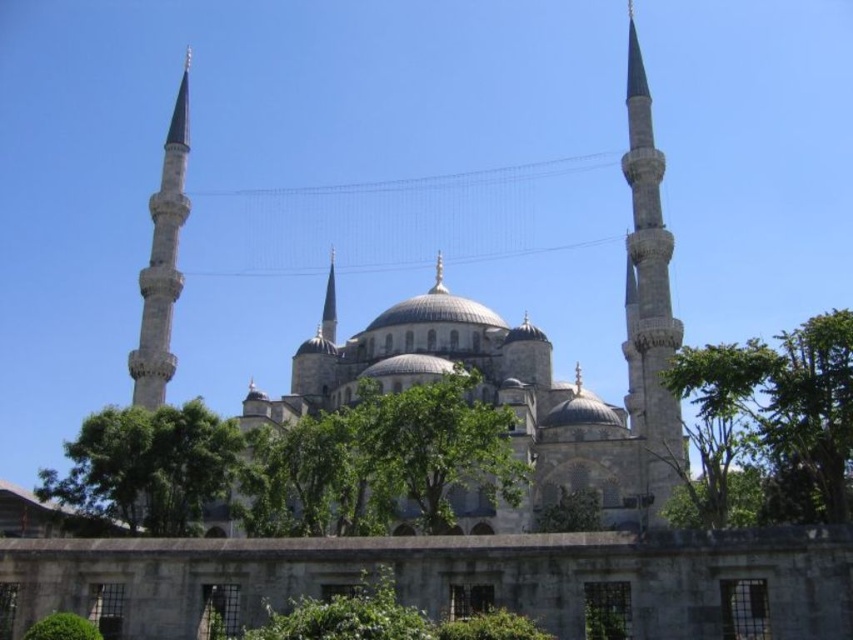
You are standing in front of the Blue Mosque and want to take a photo that includes both the green leafy tree at lower left and the smooth stone minaret at right. Based on their widths, which object should you frame first to ensure both fit in the shot?

The green leafy tree at lower left might be wider than smooth stone minaret at right, so you should frame the green leafy tree at lower left first to ensure both fit in the shot.

Consider the image. You are a landscape architect planning to install a walkway between the two green leafy trees. The walkway requires a minimum of 10 meters of space. Can the walkway be placed between the green leafy tree at center and the green leafy tree at lower center?

The distance between the green leafy tree at center and the green leafy tree at lower center is 12.15 meters, which exceeds the required 10 meters. Therefore, the walkway can be placed between them.